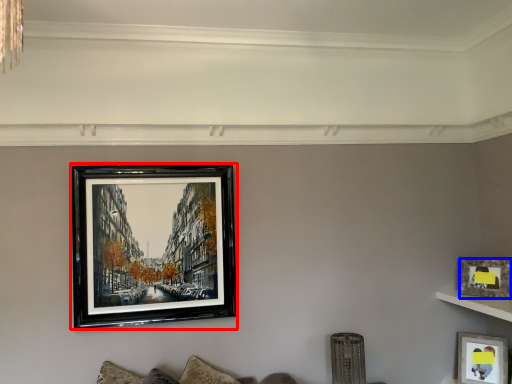
Question: Among these objects, which one is farthest to the camera, picture frame (highlighted by a red box) or picture frame (highlighted by a blue box)?

Choices:
 (A) picture frame
 (B) picture frame

Answer: (B)